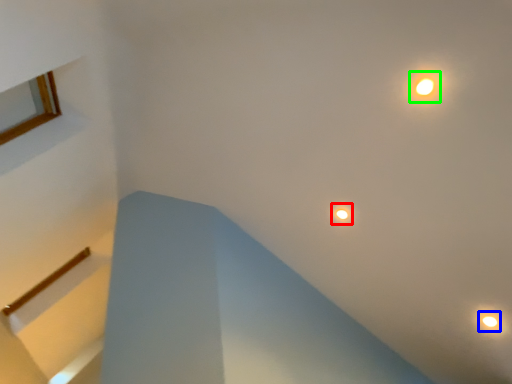
Question: Which object is positioned closest to droplight (highlighted by a red box)? Select from droplight (highlighted by a blue box) and light (highlighted by a green box).

Choices:
 (A) droplight
 (B) light

Answer: (B)